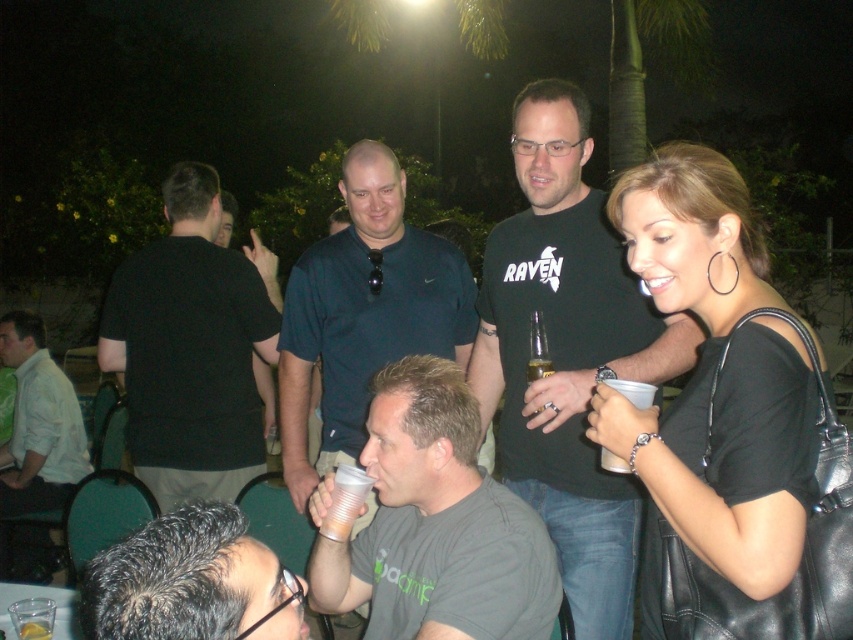
Question: Which point is closer to the camera?

Choices:
 (A) pyautogui.click(x=746, y=244)
 (B) pyautogui.click(x=125, y=612)
 (C) pyautogui.click(x=56, y=429)

Answer: (B)

Question: Does black cotton polo shirt at upper center lie behind light beige shirt at lower left?

Choices:
 (A) no
 (B) yes

Answer: (A)

Question: Is black leather purse at right thinner than black cotton polo shirt at upper center?

Choices:
 (A) no
 (B) yes

Answer: (B)

Question: Which point is closer to the camera taking this photo?

Choices:
 (A) (109, 346)
 (B) (238, 595)

Answer: (B)

Question: Is gray matte t-shirt at center thinner than black cotton polo shirt at upper center?

Choices:
 (A) no
 (B) yes

Answer: (A)

Question: Which of the following is the farthest from the observer?

Choices:
 (A) (50, 632)
 (B) (210, 264)
 (C) (390, 276)
 (D) (206, 515)

Answer: (B)